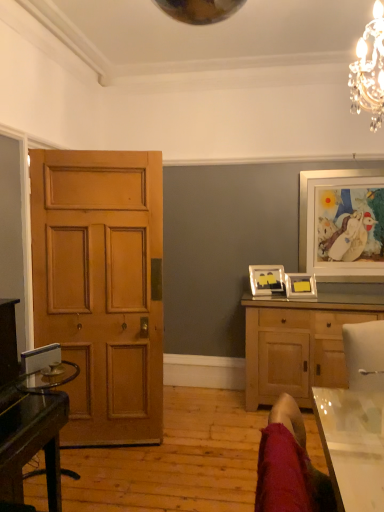
The image size is (384, 512). What do you see at coordinates (342, 224) in the screenshot?
I see `white glossy picture frame at upper right, the third picture frame viewed from the left` at bounding box center [342, 224].

Locate an element on the screen. This screenshot has height=512, width=384. light brown wooden door at left is located at coordinates (102, 287).

The width and height of the screenshot is (384, 512). I want to click on metallic silver picture frame at center-right, the 2th picture frame when ordered from right to left, so click(x=300, y=286).

What is the approximate height of wooden cabinet at right?

38.24 inches.

What do you see at coordinates (266, 280) in the screenshot?
I see `matte black picture frame at center-right, acting as the third picture frame starting from the right` at bounding box center [266, 280].

What do you see at coordinates (289, 466) in the screenshot? I see `velvet red swivel chair at lower right` at bounding box center [289, 466].

Where is `white glossy picture frame at upper right, the third picture frame viewed from the left`? The image size is (384, 512). white glossy picture frame at upper right, the third picture frame viewed from the left is located at coordinates (342, 224).

Considering the relative sizes of white glossy picture frame at upper right, placed as the 1th picture frame when sorted from right to left, and metallic silver picture frame at center-right, the 2th picture frame when ordered from right to left, in the image provided, is white glossy picture frame at upper right, placed as the 1th picture frame when sorted from right to left, taller than metallic silver picture frame at center-right, the 2th picture frame when ordered from right to left,?

Indeed, white glossy picture frame at upper right, placed as the 1th picture frame when sorted from right to left, has a greater height compared to metallic silver picture frame at center-right, the 2th picture frame when ordered from right to left.

Which is behind, point (366, 179) or point (314, 297)?

The point (366, 179) is farther.

In the image, is white glossy picture frame at upper right, placed as the 1th picture frame when sorted from right to left, on the left side or the right side of metallic silver picture frame at center-right, the second picture frame in the left-to-right sequence?

white glossy picture frame at upper right, placed as the 1th picture frame when sorted from right to left, is positioned on metallic silver picture frame at center-right, the second picture frame in the left-to-right sequence,'s right side.

In the image, is matte black picture frame at center-right, acting as the third picture frame starting from the right, positioned in front of or behind wooden cabinet at right?

Visually, matte black picture frame at center-right, acting as the third picture frame starting from the right, is located behind wooden cabinet at right.

Starting from the wooden cabinet at right, which picture frame is the 2nd one to the left? Please provide its 2D coordinates.

[(266, 280)]

Between matte black picture frame at center-right, acting as the third picture frame starting from the right, and wooden cabinet at right, which one appears on the left side from the viewer's perspective?

From the viewer's perspective, matte black picture frame at center-right, acting as the third picture frame starting from the right, appears more on the left side.

What's the angular difference between matte black picture frame at center-right, which is the first picture frame in left-to-right order, and wooden cabinet at right's facing directions?

23.8 degrees.

From a real-world perspective, is matte black picture frame at center-right, which is the first picture frame in left-to-right order, positioned over transparent glass table at lower right based on gravity?

Indeed, from a real-world perspective, matte black picture frame at center-right, which is the first picture frame in left-to-right order, stands above transparent glass table at lower right.

In terms of size, does matte black picture frame at center-right, which is the first picture frame in left-to-right order, appear bigger or smaller than transparent glass table at lower right?

In the image, matte black picture frame at center-right, which is the first picture frame in left-to-right order, appears to be smaller than transparent glass table at lower right.

How many degrees apart are the facing directions of matte black picture frame at center-right, which is the first picture frame in left-to-right order, and transparent glass table at lower right?

There is a 64.8-degree angle between the facing directions of matte black picture frame at center-right, which is the first picture frame in left-to-right order, and transparent glass table at lower right.

Considering the positions of objects matte black picture frame at center-right, which is the first picture frame in left-to-right order, and transparent glass table at lower right in the image provided, who is more to the right, matte black picture frame at center-right, which is the first picture frame in left-to-right order, or transparent glass table at lower right?

matte black picture frame at center-right, which is the first picture frame in left-to-right order, is more to the right.

Based on the photo, can you confirm if glass transparent desk at left is taller than white glossy picture frame at upper right, placed as the 1th picture frame when sorted from right to left?

No, glass transparent desk at left is not taller than white glossy picture frame at upper right, placed as the 1th picture frame when sorted from right to left.

Is glass transparent desk at left not close to white glossy picture frame at upper right, placed as the 1th picture frame when sorted from right to left?

Yes.

Is glass transparent desk at left not inside white glossy picture frame at upper right, the third picture frame viewed from the left?

That's correct, glass transparent desk at left is outside of white glossy picture frame at upper right, the third picture frame viewed from the left.

Locate an element on the screen. desk below the white glossy picture frame at upper right, placed as the 1th picture frame when sorted from right to left (from the image's perspective) is located at coordinates (33, 431).

Does velvet red swivel chair at lower right appear on the left side of metallic silver picture frame at center-right, the second picture frame in the left-to-right sequence?

Correct, you'll find velvet red swivel chair at lower right to the left of metallic silver picture frame at center-right, the second picture frame in the left-to-right sequence.

Looking at this image, is velvet red swivel chair at lower right inside or outside of metallic silver picture frame at center-right, the 2th picture frame when ordered from right to left?

velvet red swivel chair at lower right is not enclosed by metallic silver picture frame at center-right, the 2th picture frame when ordered from right to left.

Is velvet red swivel chair at lower right with metallic silver picture frame at center-right, the second picture frame in the left-to-right sequence?

No, velvet red swivel chair at lower right is not with metallic silver picture frame at center-right, the second picture frame in the left-to-right sequence.

Can you confirm if velvet red swivel chair at lower right is wider than metallic silver picture frame at center-right, the 2th picture frame when ordered from right to left?

Yes.

Which object is thinner, wooden cabinet at right or metallic silver picture frame at center-right, the second picture frame in the left-to-right sequence?

metallic silver picture frame at center-right, the second picture frame in the left-to-right sequence.

From the image's perspective, which one is positioned higher, wooden cabinet at right or metallic silver picture frame at center-right, the second picture frame in the left-to-right sequence?

metallic silver picture frame at center-right, the second picture frame in the left-to-right sequence, is shown above in the image.

Would you say wooden cabinet at right contains metallic silver picture frame at center-right, the second picture frame in the left-to-right sequence?

No.

Considering the relative sizes of wooden cabinet at right and metallic silver picture frame at center-right, the 2th picture frame when ordered from right to left, in the image provided, is wooden cabinet at right bigger than metallic silver picture frame at center-right, the 2th picture frame when ordered from right to left,?

Correct, wooden cabinet at right is larger in size than metallic silver picture frame at center-right, the 2th picture frame when ordered from right to left.

Would you say transparent glass table at lower right is part of wooden cabinet at right's contents?

Definitely not — transparent glass table at lower right is not inside wooden cabinet at right.

Between wooden cabinet at right and transparent glass table at lower right, which one appears on the right side from the viewer's perspective?

wooden cabinet at right is more to the right.

Are wooden cabinet at right and transparent glass table at lower right located far from each other?

Absolutely, wooden cabinet at right is distant from transparent glass table at lower right.

Which of these two, wooden cabinet at right or transparent glass table at lower right, is bigger?

wooden cabinet at right.

The height and width of the screenshot is (512, 384). I want to click on picture frame to the right of metallic silver picture frame at center-right, the 2th picture frame when ordered from right to left, so click(x=342, y=224).

This screenshot has width=384, height=512. There is a wooden cabinet at right. Find the location of `the 2nd picture frame above it (from a real-world perspective)`. the 2nd picture frame above it (from a real-world perspective) is located at coordinates (266, 280).

Estimate the real-world distances between objects in this image. Which object is further from white glossy picture frame at upper right, placed as the 1th picture frame when sorted from right to left, light brown wooden door at left or glass transparent desk at left?

glass transparent desk at left.

Based on their spatial positions, is matte black picture frame at center-right, acting as the third picture frame starting from the right, or metallic silver picture frame at center-right, the 2th picture frame when ordered from right to left, closer to white glossy picture frame at upper right, placed as the 1th picture frame when sorted from right to left?

Based on the image, metallic silver picture frame at center-right, the 2th picture frame when ordered from right to left, appears to be nearer to white glossy picture frame at upper right, placed as the 1th picture frame when sorted from right to left.

From the image, which object appears to be farther from velvet red swivel chair at lower right, matte black picture frame at center-right, acting as the third picture frame starting from the right, or glass transparent desk at left?

Based on the image, matte black picture frame at center-right, acting as the third picture frame starting from the right, appears to be further to velvet red swivel chair at lower right.

When comparing their distances from metallic silver picture frame at center-right, the second picture frame in the left-to-right sequence, does matte black picture frame at center-right, acting as the third picture frame starting from the right, or glass transparent desk at left seem closer?

matte black picture frame at center-right, acting as the third picture frame starting from the right.

When comparing their distances from metallic silver picture frame at center-right, the 2th picture frame when ordered from right to left, does light brown wooden door at left or glass transparent desk at left seem further?

glass transparent desk at left lies further to metallic silver picture frame at center-right, the 2th picture frame when ordered from right to left, than the other object.

Based on the photo, which object lies further to the anchor point wooden cabinet at right, velvet red swivel chair at lower right or transparent glass table at lower right?

Among the two, velvet red swivel chair at lower right is located further to wooden cabinet at right.

Which object lies nearer to the anchor point white glossy picture frame at upper right, the third picture frame viewed from the left, light brown wooden door at left or metallic silver picture frame at center-right, the second picture frame in the left-to-right sequence?

Based on the image, metallic silver picture frame at center-right, the second picture frame in the left-to-right sequence, appears to be nearer to white glossy picture frame at upper right, the third picture frame viewed from the left.

Considering their positions, is velvet red swivel chair at lower right positioned further to transparent glass table at lower right than light brown wooden door at left?

Among the two, light brown wooden door at left is located further to transparent glass table at lower right.

Find the location of `table between velvet red swivel chair at lower right and metallic silver picture frame at center-right, the 2th picture frame when ordered from right to left, from front to back`. table between velvet red swivel chair at lower right and metallic silver picture frame at center-right, the 2th picture frame when ordered from right to left, from front to back is located at coordinates (352, 445).

You are a GUI agent. You are given a task and a screenshot of the screen. Output one action in this format:
    pyautogui.click(x=<x>, y=<y>)
    Task: Click on the door located between glass transparent desk at left and matte black picture frame at center-right, acting as the third picture frame starting from the right, in the left-right direction
    This screenshot has height=512, width=384.
    Given the screenshot: What is the action you would take?
    click(102, 287)

Where is `door between velvet red swivel chair at lower right and white glossy picture frame at upper right, the third picture frame viewed from the left, along the z-axis`? door between velvet red swivel chair at lower right and white glossy picture frame at upper right, the third picture frame viewed from the left, along the z-axis is located at coordinates tap(102, 287).

Find the location of a particular element. The width and height of the screenshot is (384, 512). table between velvet red swivel chair at lower right and wooden cabinet at right in the front-back direction is located at coordinates (352, 445).